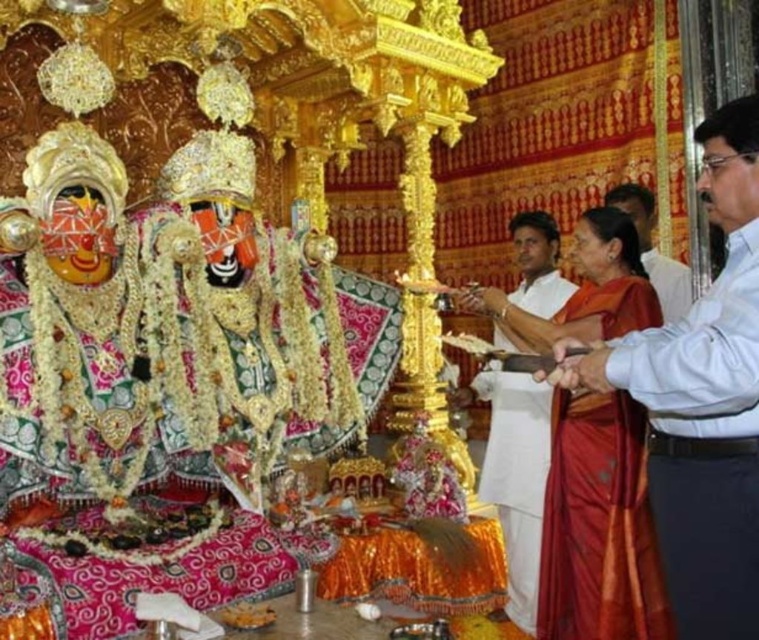
Question: Estimate the real-world distances between objects in this image. Which object is closer to the silky red saree at right?

Choices:
 (A) white cotton shirt at right
 (B) silky orange sari at center

Answer: (B)

Question: Considering the relative positions of silky orange sari at center and white cotton shirt at right in the image provided, where is silky orange sari at center located with respect to white cotton shirt at right?

Choices:
 (A) above
 (B) below

Answer: (B)

Question: Which object is positioned closest to the maroon silk saree at right?

Choices:
 (A) silky orange sari at center
 (B) silky red saree at right
 (C) white cotton shirt at right

Answer: (B)

Question: Is maroon silk saree at right smaller than silky orange sari at center?

Choices:
 (A) yes
 (B) no

Answer: (A)

Question: Which is nearer to the white cotton shirt at right?

Choices:
 (A) silky red saree at right
 (B) maroon silk saree at right
 (C) silky orange sari at center

Answer: (C)

Question: Is silky red saree at right thinner than silky orange sari at center?

Choices:
 (A) no
 (B) yes

Answer: (B)